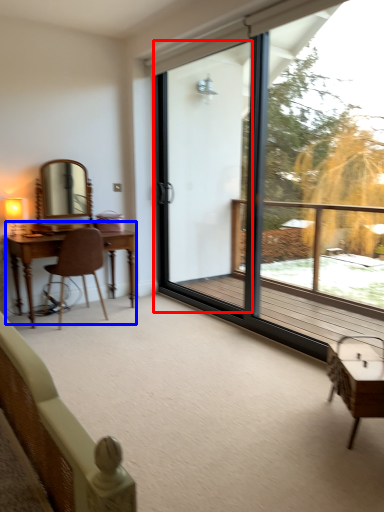
Question: Which object is closer to the camera taking this photo, screen door (highlighted by a red box) or table (highlighted by a blue box)?

Choices:
 (A) screen door
 (B) table

Answer: (A)